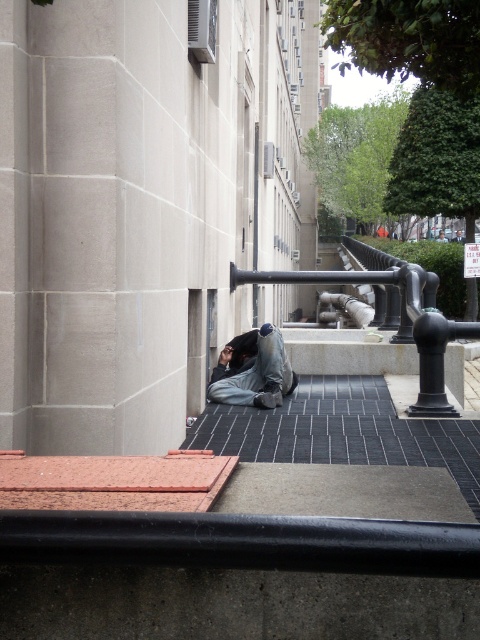
You are a delivery robot with a 2.5 feet wide package. You need to deliver it to the person wearing denim pants at lower center. There is a black metal rail at center in your path. Can you safely navigate around the rail to reach the person?

The black metal rail at center and denim pants at lower center are 5.96 feet apart. Since the distance between them is greater than the package width of 2.5 feet, the robot can safely navigate around the rail to reach the person wearing denim pants at lower center.

You are a delivery person trying to reach the person sitting against the building. The black metal rail at center and denim pants at lower center are in your way. Which obstacle should you move around first?

The black metal rail at center is bigger than the denim pants at lower center, so you should move around the black metal rail at center first since it is larger and requires more space to navigate around.